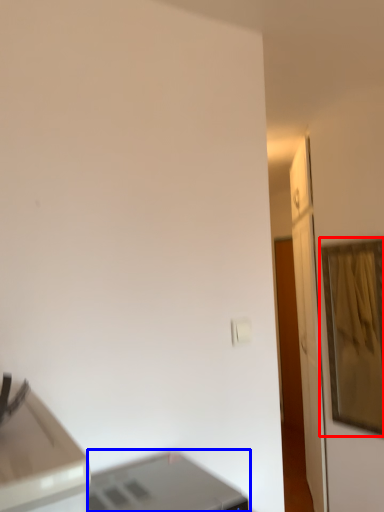
Question: Which of the following is the farthest to the observer, picture frame (highlighted by a red box) or printer (highlighted by a blue box)?

Choices:
 (A) picture frame
 (B) printer

Answer: (A)